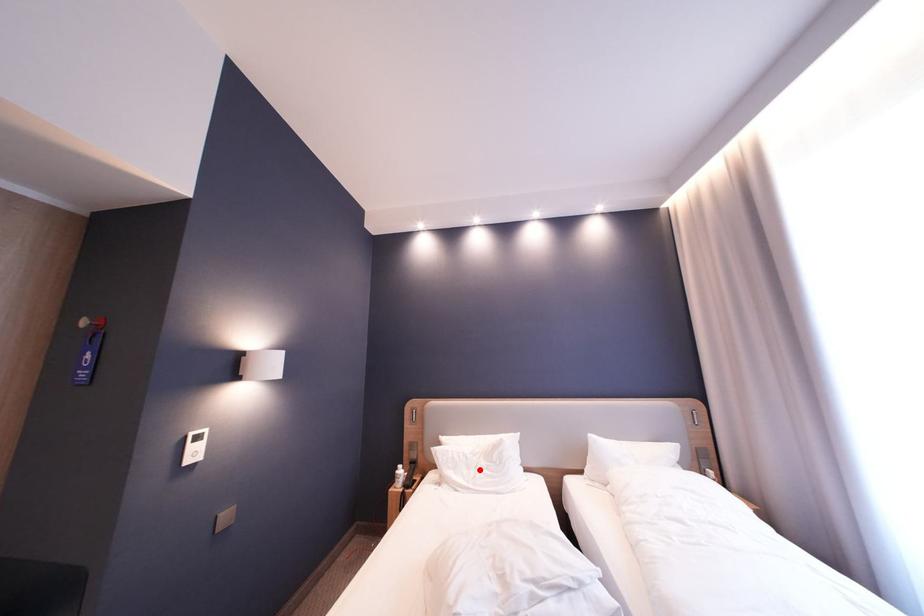
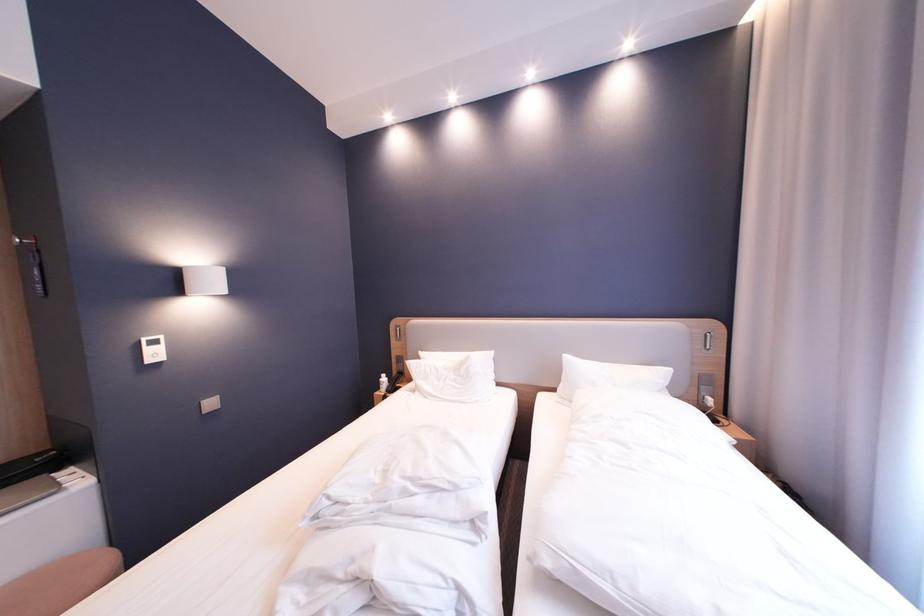
In the second image, find the point that corresponds to the highlighted location in the first image.

(450, 382)